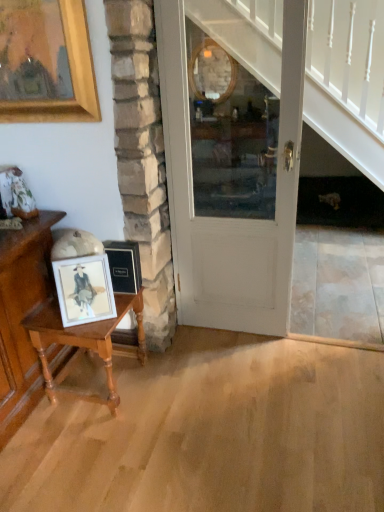
Identify the location of space that is in front of wooden table at left. (85, 443).